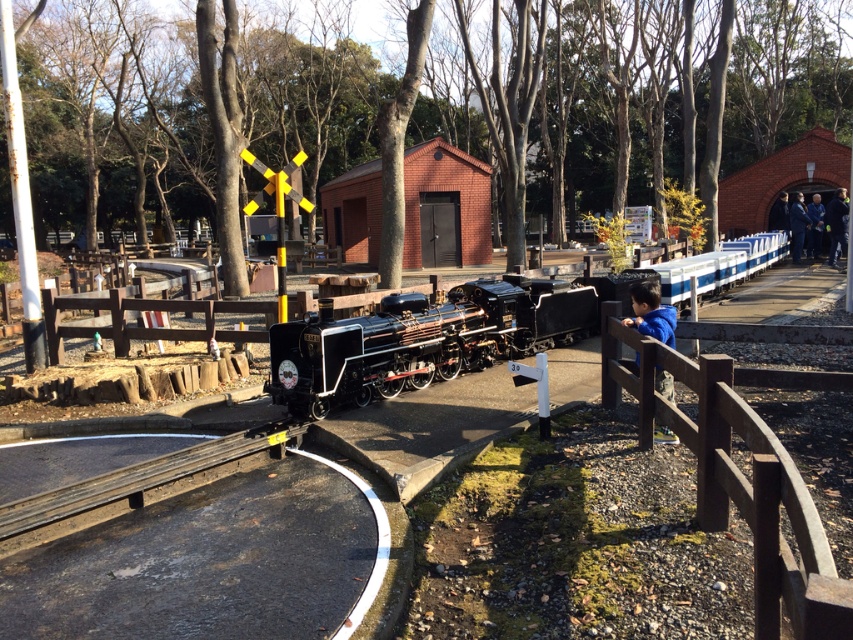
Question: Which point appears closest to the camera in this image?

Choices:
 (A) (651, 307)
 (B) (437, 371)

Answer: (A)

Question: Which of the following is the farthest from the observer?

Choices:
 (A) blue fleece jacket at center
 (B) polished black locomotive at center
 (C) brown wooden fence at center
 (D) black rubber train track at lower center

Answer: (B)

Question: Does polished black locomotive at center have a larger size compared to blue fleece jacket at center?

Choices:
 (A) yes
 (B) no

Answer: (A)

Question: Is polished black locomotive at center positioned in front of brown wooden fence at center?

Choices:
 (A) yes
 (B) no

Answer: (B)

Question: Based on their relative distances, which object is farther from the polished black locomotive at center?

Choices:
 (A) brown wooden fence at center
 (B) blue fleece jacket at center
 (C) black rubber train track at lower center

Answer: (B)

Question: Can you confirm if polished black locomotive at center is bigger than brown wooden fence at center?

Choices:
 (A) no
 (B) yes

Answer: (B)